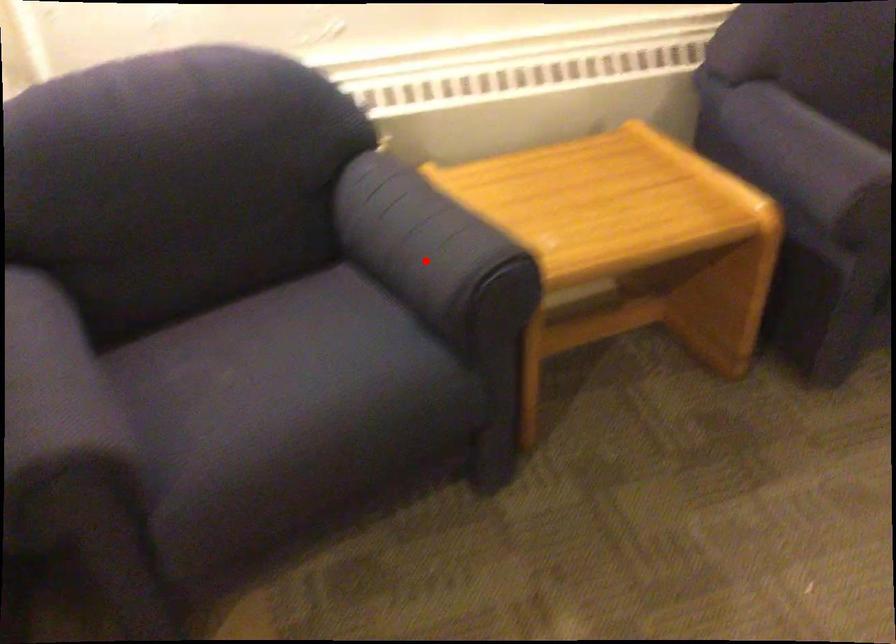
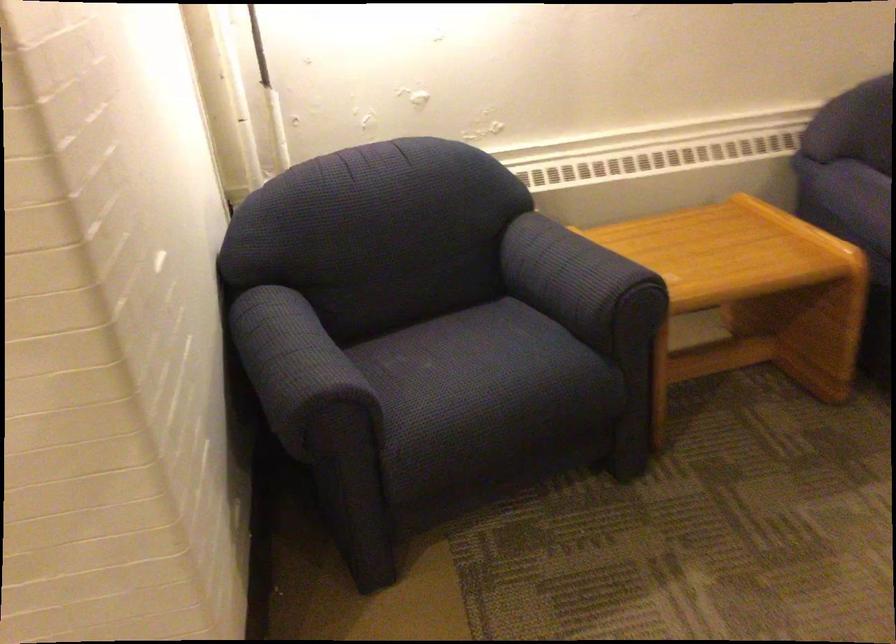
Question: I am providing you with two images of the same scene from different viewpoints. Image1 has a red point marked. In image2, the corresponding 3D location appears at what relative position? Reply with the corresponding letter.

Choices:
 (A) Closer
 (B) Farther

Answer: (B)